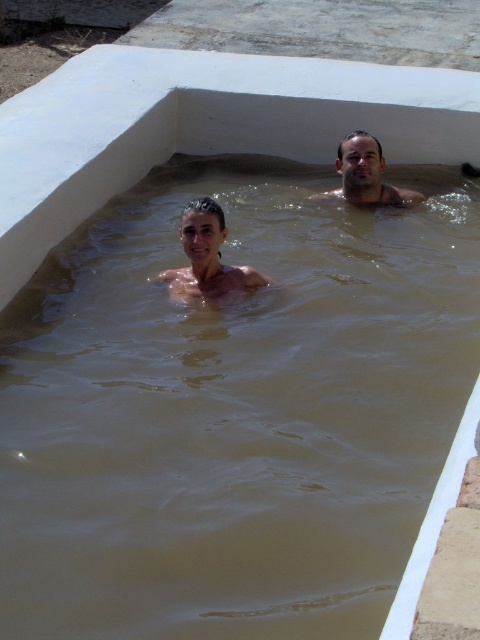
You are designing a life vest for the smooth skin woman at center and the brown skin man at upper right in the pool. Considering their sizes, which one might need a larger life vest?

The brown skin man at upper right needs a larger life vest because he occupies more space than the smooth skin woman at center.

You are designing a life jacket that needs to fit both the smooth skin woman at center and the brown skin man at upper right. Based on their widths, which person requires a larger life jacket size?

The brown skin man at upper right requires a larger life jacket size because his width is greater than that of the smooth skin woman at center.